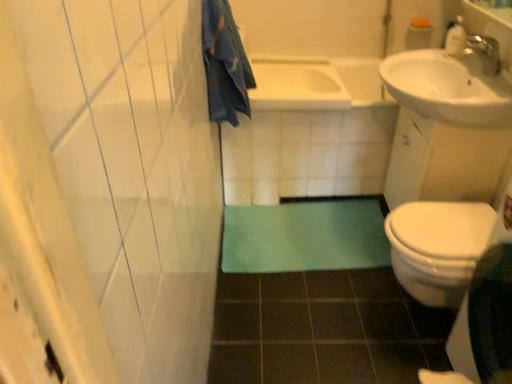
What do you see at coordinates (456, 38) in the screenshot? I see `white plastic soap dispenser at upper right` at bounding box center [456, 38].

This screenshot has height=384, width=512. What do you see at coordinates (305, 236) in the screenshot? I see `green rubber bath mat at lower center` at bounding box center [305, 236].

This screenshot has height=384, width=512. Describe the element at coordinates (225, 63) in the screenshot. I see `blue cotton towel at upper left` at that location.

At what (x,y) coordinates should I click in order to perform the action: click on white plastic soap dispenser at upper right. Please return your answer as a coordinate pair (x, y). The height and width of the screenshot is (384, 512). Looking at the image, I should click on (456, 38).

Is white plastic soap dispenser at upper right in front of green rubber bath mat at lower center?

Yes, white plastic soap dispenser at upper right is closer to the viewer.

Based on the photo, from the image's perspective, between white plastic soap dispenser at upper right and green rubber bath mat at lower center, which one is located above?

white plastic soap dispenser at upper right.

Which point is more distant from viewer, (463, 29) or (252, 245)?

The point (252, 245) is more distant.

Considering the relative positions of white plastic soap dispenser at upper right and green rubber bath mat at lower center in the image provided, is white plastic soap dispenser at upper right to the left of green rubber bath mat at lower center from the viewer's perspective?

No, white plastic soap dispenser at upper right is not to the left of green rubber bath mat at lower center.

Considering the sizes of blue cotton towel at upper left and green rubber bath mat at lower center in the image, is blue cotton towel at upper left taller or shorter than green rubber bath mat at lower center?

In the image, blue cotton towel at upper left appears to be taller than green rubber bath mat at lower center.

Is blue cotton towel at upper left wider or thinner than green rubber bath mat at lower center?

Clearly, blue cotton towel at upper left has less width compared to green rubber bath mat at lower center.

Is point (220, 77) in front of point (273, 244)?

Yes, it is in front of point (273, 244).

Considering the positions of objects green rubber bath mat at lower center and white glossy sink at upper right in the image provided, who is in front, green rubber bath mat at lower center or white glossy sink at upper right?

white glossy sink at upper right is more forward.

Is green rubber bath mat at lower center facing away from white glossy sink at upper right?

No, green rubber bath mat at lower center's orientation is not away from white glossy sink at upper right.

From the image's perspective, does green rubber bath mat at lower center appear higher than white glossy sink at upper right?

No, from the image's perspective, green rubber bath mat at lower center is not over white glossy sink at upper right.

In the image, is green rubber bath mat at lower center on the left side or the right side of white glossy sink at upper right?

In the image, green rubber bath mat at lower center appears on the left side of white glossy sink at upper right.

Where is `toiletry above the white glossy bathtub at center, which is counted as the 1th bath, starting from the right (from the image's perspective)`? toiletry above the white glossy bathtub at center, which is counted as the 1th bath, starting from the right (from the image's perspective) is located at coordinates (456, 38).

Is white plastic soap dispenser at upper right inside white glossy bathtub at center, which is counted as the 1th bath, starting from the right?

Definitely not — white plastic soap dispenser at upper right is not inside white glossy bathtub at center, which is counted as the 1th bath, starting from the right.

Is point (280, 170) more distant than point (453, 40)?

That is True.

From the image's perspective, is white glossy bathtub at center, placed as the 2th bath when sorted from left to right, below white plastic soap dispenser at upper right?

Correct, white glossy bathtub at center, placed as the 2th bath when sorted from left to right, appears lower than white plastic soap dispenser at upper right in the image.

Can you confirm if white glossy bathtub at center, which is counted as the 1th bath, starting from the right, is thinner than silver metallic faucet at upper right?

In fact, white glossy bathtub at center, which is counted as the 1th bath, starting from the right, might be wider than silver metallic faucet at upper right.

Measure the distance between white glossy bathtub at center, which is counted as the 1th bath, starting from the right, and silver metallic faucet at upper right.

A distance of 79.62 centimeters exists between white glossy bathtub at center, which is counted as the 1th bath, starting from the right, and silver metallic faucet at upper right.

From the image's perspective, between white glossy bathtub at center, placed as the 2th bath when sorted from left to right, and silver metallic faucet at upper right, who is located below?

white glossy bathtub at center, placed as the 2th bath when sorted from left to right, appears lower in the image.

Can you confirm if white glossy bathtub at center, placed as the 2th bath when sorted from left to right, is bigger than silver metallic faucet at upper right?

Correct, white glossy bathtub at center, placed as the 2th bath when sorted from left to right, is larger in size than silver metallic faucet at upper right.

Considering the positions of objects white glossy bathtub at center, the 2th bath positioned from the right, and silver metallic faucet at upper right in the image provided, who is in front, white glossy bathtub at center, the 2th bath positioned from the right, or silver metallic faucet at upper right?

Positioned in front is silver metallic faucet at upper right.

Is point (336, 83) in front of point (494, 73)?

No, (336, 83) is further to viewer.

Is silver metallic faucet at upper right at the back of white glossy bathtub at center, the 2th bath positioned from the right?

No, silver metallic faucet at upper right is not at the back of white glossy bathtub at center, the 2th bath positioned from the right.

Considering the sizes of white glossy bathtub at center, which is counted as the 1th bath, starting from the left, and silver metallic faucet at upper right in the image, is white glossy bathtub at center, which is counted as the 1th bath, starting from the left, wider or thinner than silver metallic faucet at upper right?

In the image, white glossy bathtub at center, which is counted as the 1th bath, starting from the left, appears to be wider than silver metallic faucet at upper right.

Does silver metallic faucet at upper right have a lesser width compared to white plastic soap dispenser at upper right?

No.

Does silver metallic faucet at upper right turn towards white plastic soap dispenser at upper right?

No, silver metallic faucet at upper right is not oriented towards white plastic soap dispenser at upper right.

Is silver metallic faucet at upper right far from white plastic soap dispenser at upper right?

That's not correct — silver metallic faucet at upper right is a little close to white plastic soap dispenser at upper right.

From the image's perspective, is silver metallic faucet at upper right above or below white plastic soap dispenser at upper right?

silver metallic faucet at upper right is below white plastic soap dispenser at upper right.

This screenshot has width=512, height=384. Identify the location of bath mat behind the white plastic soap dispenser at upper right. (305, 236).

In the image, there is a green rubber bath mat at lower center. Identify the location of bath towel above it (from the image's perspective). The image size is (512, 384). (225, 63).

When comparing their distances from blue cotton towel at upper left, does white glossy bathtub at center, placed as the 2th bath when sorted from left to right, or silver metallic faucet at upper right seem closer?

white glossy bathtub at center, placed as the 2th bath when sorted from left to right, is closer to blue cotton towel at upper left.

When comparing their distances from green rubber bath mat at lower center, does white glossy sink at upper right or white glossy bathtub at center, the 2th bath positioned from the right, seem further?

Among the two, white glossy sink at upper right is located further to green rubber bath mat at lower center.

From the image, which object appears to be farther from white glossy bathtub at center, which is counted as the 1th bath, starting from the right, green rubber bath mat at lower center or white plastic soap dispenser at upper right?

white plastic soap dispenser at upper right is further to white glossy bathtub at center, which is counted as the 1th bath, starting from the right.

Which object lies nearer to the anchor point green rubber bath mat at lower center, white glossy bathtub at center, the 2th bath positioned from the right, or white glossy sink at upper right?

Among the two, white glossy bathtub at center, the 2th bath positioned from the right, is located nearer to green rubber bath mat at lower center.

Considering their positions, is silver metallic faucet at upper right positioned further to white glossy sink at upper right than white plastic soap dispenser at upper right?

white plastic soap dispenser at upper right lies further to white glossy sink at upper right than the other object.

Based on their spatial positions, is white glossy sink at upper right or blue cotton towel at upper left closer to silver metallic faucet at upper right?

Among the two, white glossy sink at upper right is located nearer to silver metallic faucet at upper right.

From the image, which object appears to be nearer to white plastic soap dispenser at upper right, white glossy bathtub at center, placed as the 2th bath when sorted from left to right, or white glossy sink at upper right?

white glossy sink at upper right is positioned closer to the anchor white plastic soap dispenser at upper right.

From the image, which object appears to be farther from white glossy sink at upper right, white glossy bathtub at center, the 2th bath positioned from the right, or blue cotton towel at upper left?

The object further to white glossy sink at upper right is blue cotton towel at upper left.

Identify the location of bath located between blue cotton towel at upper left and white glossy bathtub at center, which is counted as the 1th bath, starting from the right, in the depth direction. (297, 84).

Where is `bath mat between blue cotton towel at upper left and silver metallic faucet at upper right in the horizontal direction`? bath mat between blue cotton towel at upper left and silver metallic faucet at upper right in the horizontal direction is located at coordinates (305, 236).

Find the location of `sink that lies between white plastic soap dispenser at upper right and green rubber bath mat at lower center from top to bottom`. sink that lies between white plastic soap dispenser at upper right and green rubber bath mat at lower center from top to bottom is located at coordinates (451, 86).

Where is `bath that lies between blue cotton towel at upper left and green rubber bath mat at lower center from top to bottom`? The image size is (512, 384). bath that lies between blue cotton towel at upper left and green rubber bath mat at lower center from top to bottom is located at coordinates (309, 131).